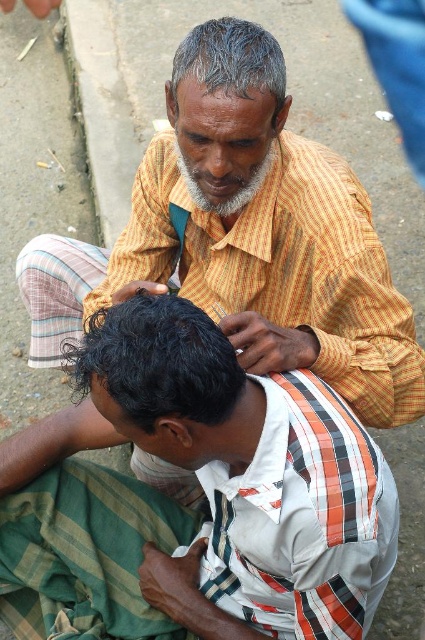
You are a photographer taking a picture of the two people in the scene. You want to focus on the person closer to the camera. Which point should you focus on, point (146, 634) or point (190, 362)?

Point (146, 634) is further to the camera than point (190, 362), so you should focus on point (146, 634) to capture the person closer to the camera.

You are a photographer taking a picture of the scene. You notice the white striped shirt at lower center and the dark brown hair at lower left. Which object should you focus on first if you want to capture both in the frame without moving the camera?

The white striped shirt at lower center is wider than the dark brown hair at lower left, so focusing on the shirt first would ensure both fit in the frame since it occupies more space.